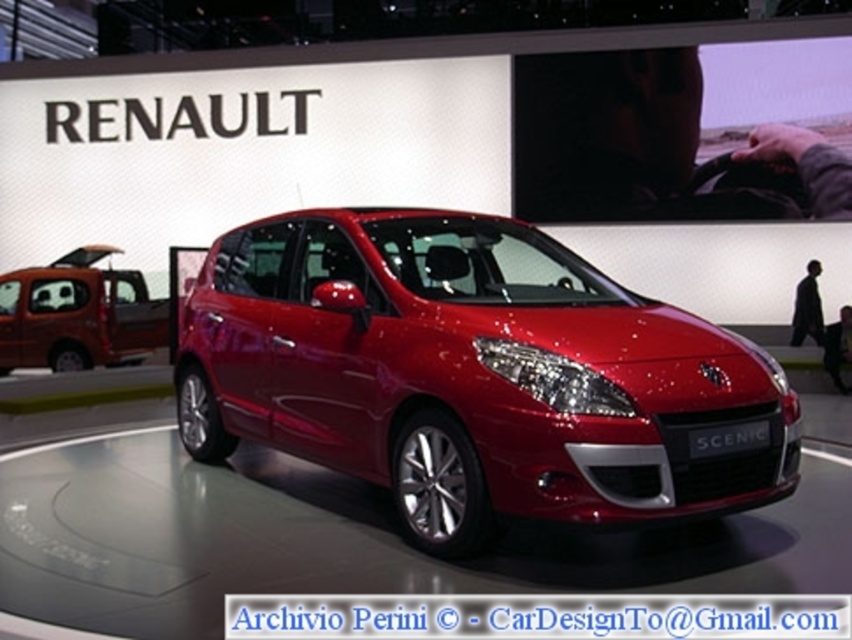
You are a photographer at the auto show and need to capture both the glossy red car at center and the matte orange van at left in a single shot. Given that your camera has a fixed focal length and limited field of view, which vehicle should you position closer to the camera to ensure both fit in the frame without cropping?

To ensure both the glossy red car at center and the matte orange van at left fit in the frame without cropping, position the larger glossy red car at center closer to the camera. Since it is larger, moving it forward will help balance their sizes in the photo, making both visible within the limited field of view.

You are at an auto show and want to take a photo of the glossy red car at center. The auto show requires you to stand exactly at point (x=473, y=374) to capture the best angle. Are you currently positioned at the correct point to take the photo?

The glossy red car at center is located at point (x=473, y=374), so yes, you are at the correct point to take the photo.

You are standing at the center of the auto show looking at the Renault Scenic car. There are two points marked in the image. Which point, point (491, 419) or point (142, 308), is closer to you?

Point (491, 419) is in front of point (142, 308), so it is closer to you.